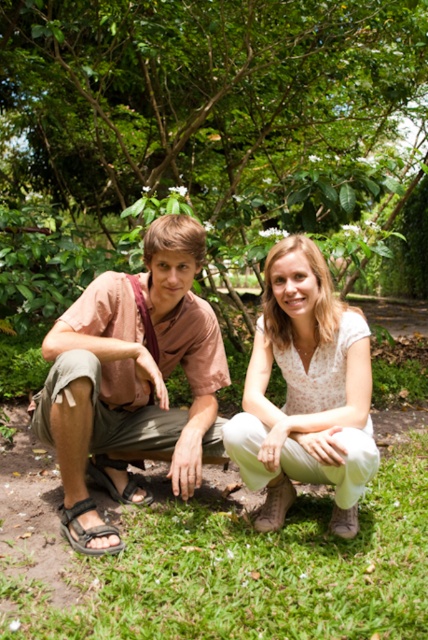
You are standing in the lush green environment and want to take a photo of the green leafy tree at center. Which direction should you face to ensure the tree is in the center of your photo?

The green leafy tree at center is located at point coordinates 0.211 on the x axis and 0.479 on the y axis. To center it in your photo, you should face towards the coordinates (205, 134).

You are planning to place a small garden bench between the green leafy tree at center and the brown leather sandal at lower left. Based on their widths, will the bench fit between them?

The green leafy tree at center might be wider than brown leather sandal at lower left, so the bench may not fit between them due to the tree potentially occupying more space.